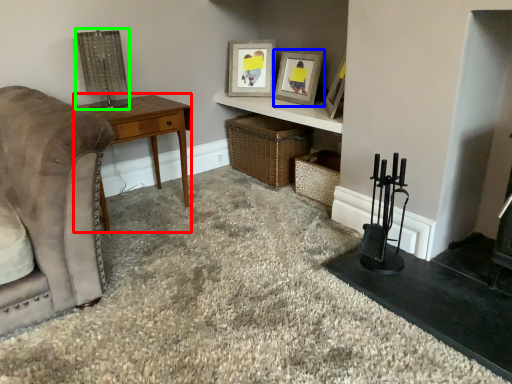
Question: Based on their relative distances, which object is nearer to desk (highlighted by a red box)? Choose from picture frame (highlighted by a blue box) and lamp (highlighted by a green box).

Choices:
 (A) picture frame
 (B) lamp

Answer: (B)